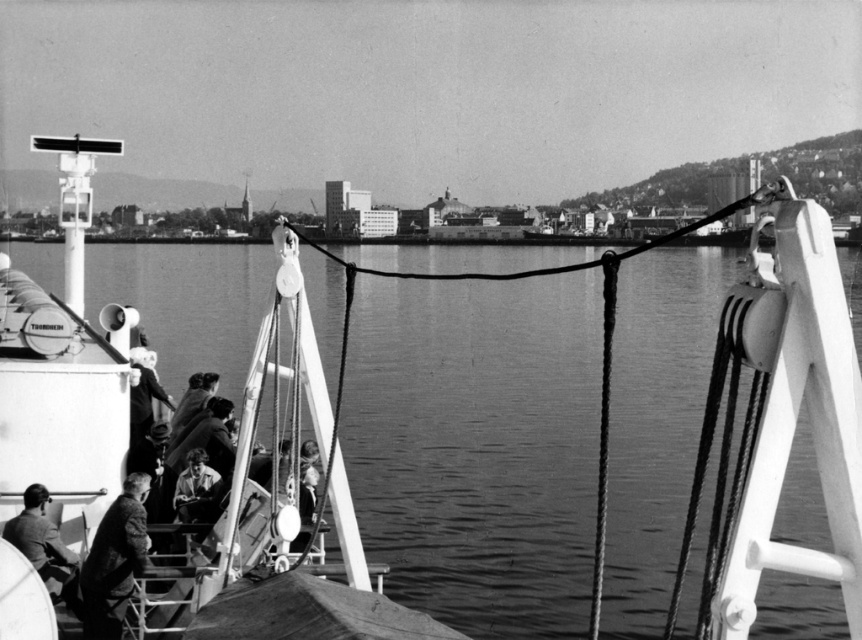
You are standing on the deck of the ship named Troms? and want to take a photo of the city in the background. The camera is at your eye level. There is a point at coordinates point [511,518] that is 312.55 feet away from the camera. If you want to ensure the city is in focus, should you adjust the focus to be closer or farther than this point?

Since the point [511,518] is 312.55 feet away from the camera, and the city is in the background, the city is farther away than this point. To ensure the city is in focus, you should adjust the focus to be farther than the point [511,518].

Consider the image. You are standing on the ship deck and want to take a photo of the city through the smooth water at center. However, there is a smooth leather jacket at lower left in the way. Can you move the jacket to get a clear shot?

The smooth water at center is in front of the smooth leather jacket at lower left, so the jacket is behind the water and not blocking the view. You don not need to move it.